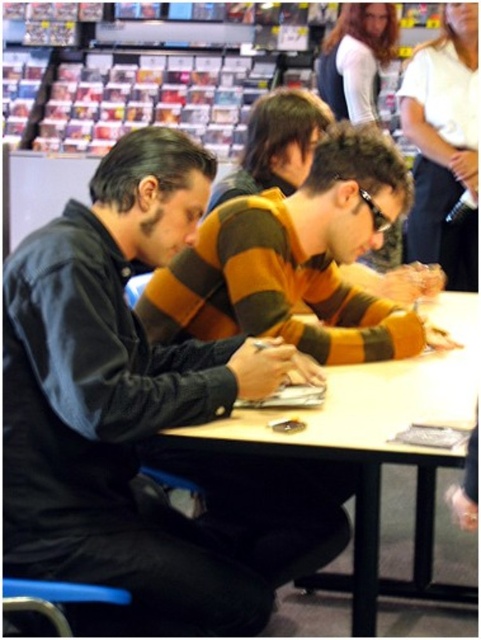
Question: Is dark blue denim jacket at center to the right of light brown wood table at center from the viewer's perspective?

Choices:
 (A) yes
 (B) no

Answer: (B)

Question: Does dark blue denim jacket at center appear on the right side of light brown wood table at center?

Choices:
 (A) yes
 (B) no

Answer: (B)

Question: Does dark blue denim jacket at center have a lesser width compared to light brown wood table at center?

Choices:
 (A) no
 (B) yes

Answer: (B)

Question: Among these objects, which one is nearest to the camera?

Choices:
 (A) dark blue denim jacket at center
 (B) light brown wood table at center

Answer: (A)